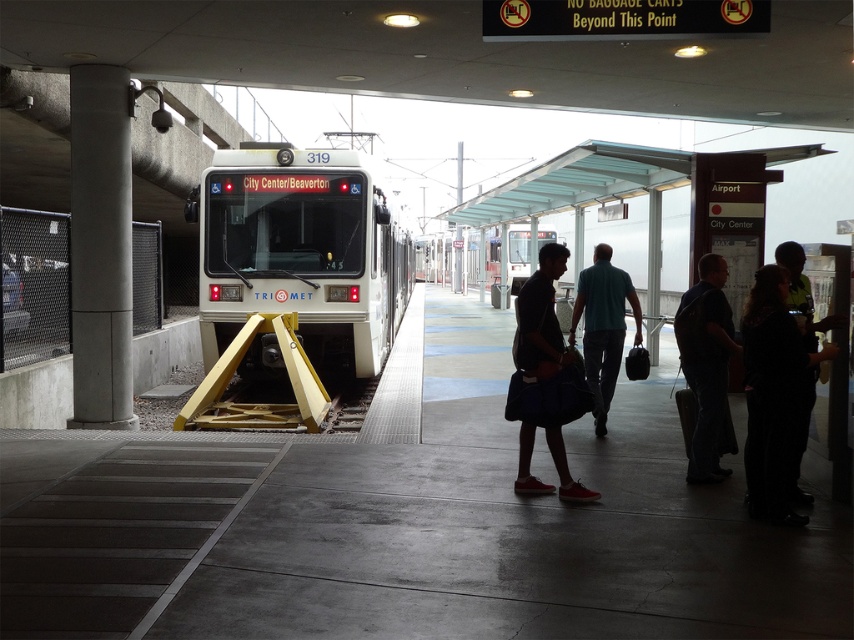
Who is more forward, [705,449] or [592,324]?

Point [705,449]

In the scene shown: Is dark blue jeans at center further to the viewer compared to teal fabric shirt at center?

No, it is in front of teal fabric shirt at center.

Does point (712, 416) lie behind point (607, 380)?

No.

Where is `dark blue jeans at center`? The width and height of the screenshot is (854, 640). dark blue jeans at center is located at coordinates (706, 362).

Which is below, black fabric at right or dark blue jeans at center?

black fabric at right

Which is more to the right, black fabric at right or dark blue jeans at center?

From the viewer's perspective, black fabric at right appears more on the right side.

Identify the location of black fabric at right. (771, 396).

Can you confirm if white glossy train at center is taller than dark blue fabric bag at center?

Correct, white glossy train at center is much taller as dark blue fabric bag at center.

From the picture: Is white glossy train at center closer to camera compared to dark blue fabric bag at center?

No, it is not.

Who is more distant from viewer, (x=346, y=356) or (x=551, y=314)?

The point (x=346, y=356) is more distant.

Where is `white glossy train at center`? The image size is (854, 640). white glossy train at center is located at coordinates (301, 253).